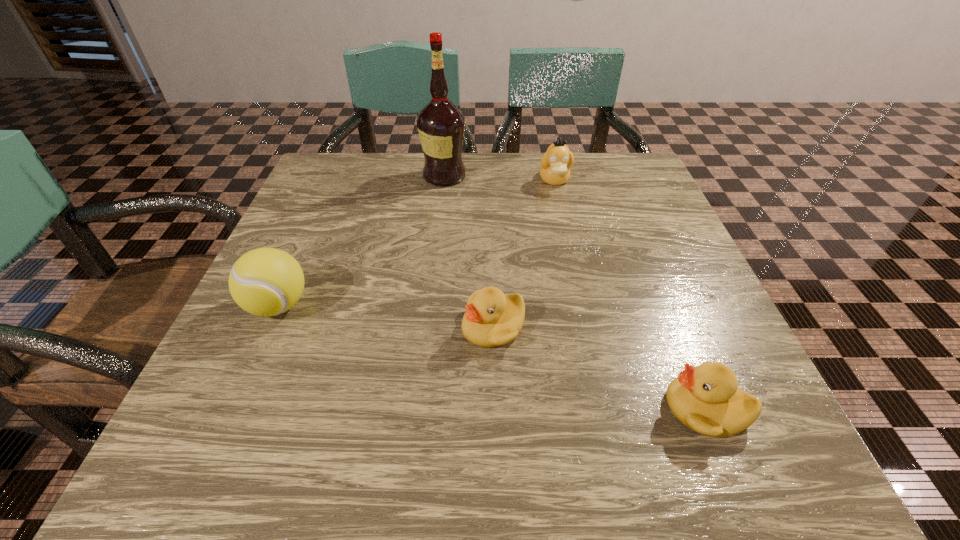
Locate an element on the screen. This screenshot has width=960, height=540. empty space that is in between the alcohol and the leftmost duckling is located at coordinates (468, 252).

Locate an element on the screen. The width and height of the screenshot is (960, 540). vacant area that lies between the alcohol and the second duckling from right to left is located at coordinates (499, 178).

At what (x,y) coordinates should I click in order to perform the action: click on empty location between the second object from left to right and the nearest duckling. Please return your answer as a coordinate pair (x, y). The image size is (960, 540). Looking at the image, I should click on point(575,292).

This screenshot has width=960, height=540. Find the location of `unoccupied area between the tennis ball and the fourth object from left to right`. unoccupied area between the tennis ball and the fourth object from left to right is located at coordinates pos(417,243).

Where is `vacant area that lies between the nearest duckling and the third object from right to left`? The image size is (960, 540). vacant area that lies between the nearest duckling and the third object from right to left is located at coordinates (600, 368).

You are a GUI agent. You are given a task and a screenshot of the screen. Output one action in this format:
    pyautogui.click(x=<x>, y=<y>)
    Task: Click on the blank region between the second nearest duckling and the second duckling from right to left
    This screenshot has width=960, height=540.
    Given the screenshot: What is the action you would take?
    pyautogui.click(x=524, y=254)

Identify the location of vacant area that lies between the farthest duckling and the leftmost duckling. Image resolution: width=960 pixels, height=540 pixels. (x=524, y=254).

Where is `vacant space in between the tallest object and the tennis ball`? The width and height of the screenshot is (960, 540). vacant space in between the tallest object and the tennis ball is located at coordinates (361, 240).

Locate an element on the screen. Image resolution: width=960 pixels, height=540 pixels. blank region between the leftmost object and the second farthest duckling is located at coordinates (386, 316).

The image size is (960, 540). In order to click on the third closest object to the rightmost duckling in this screenshot , I will do `click(266, 281)`.